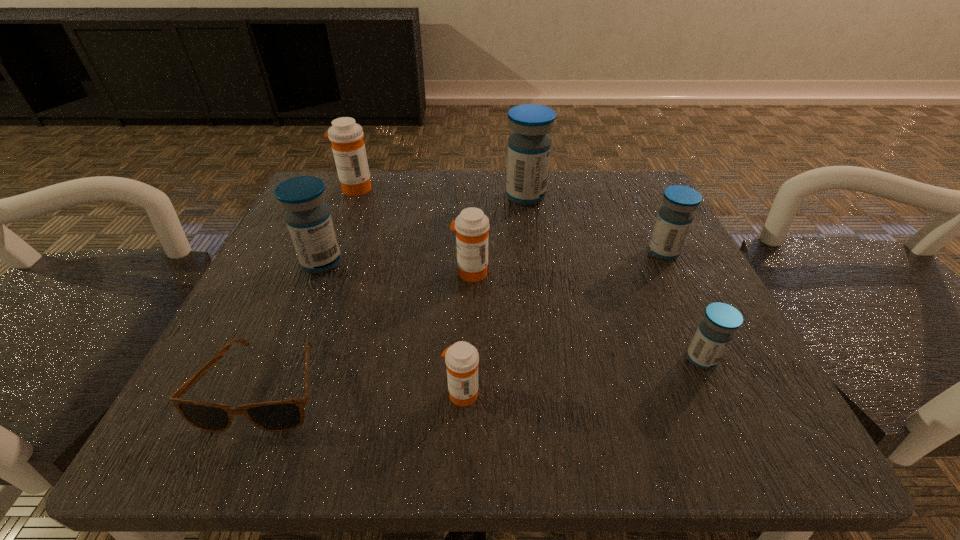
You are a GUI agent. You are given a task and a screenshot of the screen. Output one action in this format:
    pyautogui.click(x=<x>, y=<y>)
    Task: Click on the sunglasses positioned at the near edge
    
    Given the screenshot: What is the action you would take?
    pyautogui.click(x=283, y=415)

Find the location of a particular element. sunglasses that is at the left edge is located at coordinates coord(283,415).

Where is `object present at the far left corner`? object present at the far left corner is located at coordinates (348, 147).

Where is `object situated at the near left corner`? object situated at the near left corner is located at coordinates (283, 415).

Locate an element on the screen. Image resolution: width=960 pixels, height=540 pixels. free space at the far edge of the desktop is located at coordinates (555, 194).

The height and width of the screenshot is (540, 960). Identify the location of free spot at the near edge of the desktop. (611, 398).

In order to click on free spot at the right edge of the desktop in this screenshot , I will do `click(729, 372)`.

In the image, there is a desktop. At what (x,y) coordinates should I click in order to perform the action: click on vacant region at the far left corner. Please return your answer as a coordinate pair (x, y). This screenshot has width=960, height=540. Looking at the image, I should click on (341, 230).

In the image, there is a desktop. Identify the location of free space at the far right corner. tap(656, 213).

The height and width of the screenshot is (540, 960). In the image, there is a desktop. Identify the location of vacant space at the near right corner. (772, 422).